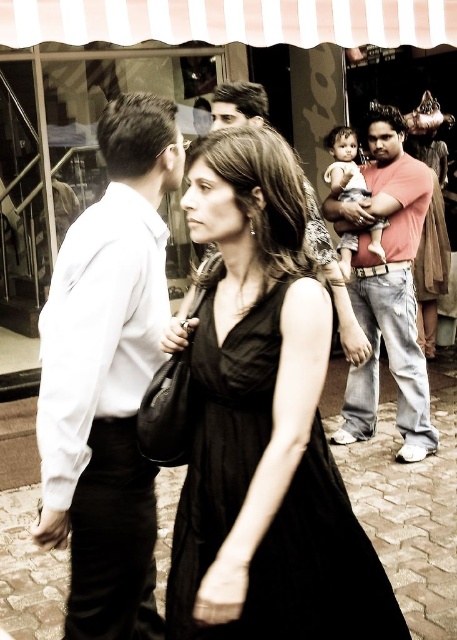
Question: Does white shirt at left have a smaller size compared to soft pink fabric at center?

Choices:
 (A) no
 (B) yes

Answer: (B)

Question: Which object appears closest to the camera in this image?

Choices:
 (A) white shirt at left
 (B) matte pink shirt at center

Answer: (A)

Question: Where is black fabric dress at center located in relation to black satin dress at center in the image?

Choices:
 (A) left
 (B) right

Answer: (B)

Question: Which of the following is the closest to the observer?

Choices:
 (A) (382, 221)
 (B) (159, 104)

Answer: (B)

Question: Among these objects, which one is nearest to the camera?

Choices:
 (A) soft pink fabric at center
 (B) white shirt at left

Answer: (B)

Question: Is black satin dress at center thinner than matte pink shirt at center?

Choices:
 (A) no
 (B) yes

Answer: (B)